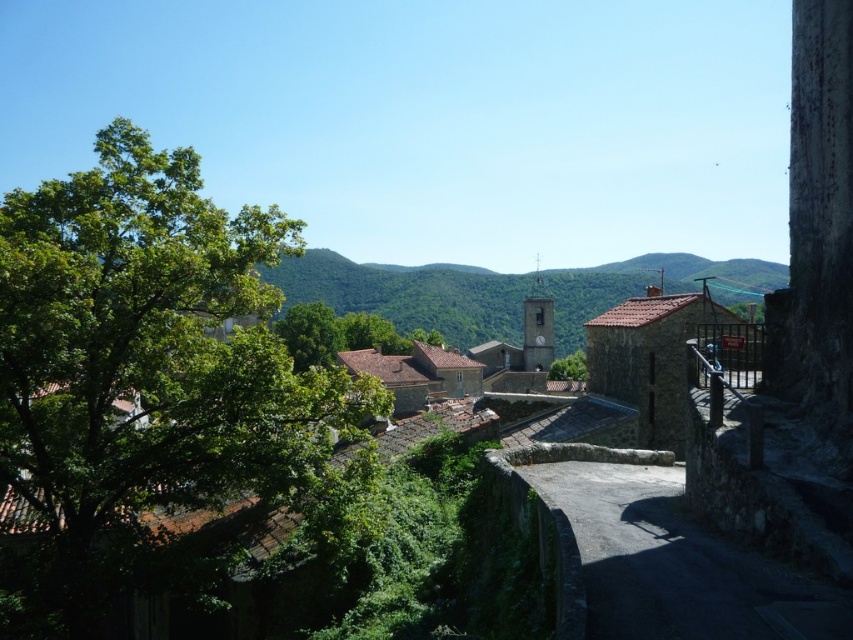
Can you confirm if green leafy tree at upper left is positioned below dark stone alley at center?

Actually, green leafy tree at upper left is above dark stone alley at center.

Is point (51, 564) positioned after point (683, 516)?

Yes.

Identify the location of green leafy tree at upper left. Image resolution: width=853 pixels, height=640 pixels. (146, 362).

Which of these two, dark stone alley at center or green leafy tree at center, stands shorter?

dark stone alley at center is shorter.

Who is more distant from viewer, (689, 627) or (575, 364)?

Point (575, 364)

Locate an element on the screen. The width and height of the screenshot is (853, 640). dark stone alley at center is located at coordinates (660, 556).

At what (x,y) coordinates should I click in order to perform the action: click on dark stone alley at center. Please return your answer as a coordinate pair (x, y). Image resolution: width=853 pixels, height=640 pixels. Looking at the image, I should click on (660, 556).

Is green leafy tree at upper left to the left of green leafy tree at center from the viewer's perspective?

Yes, green leafy tree at upper left is to the left of green leafy tree at center.

Where is `green leafy tree at upper left`? This screenshot has height=640, width=853. green leafy tree at upper left is located at coordinates (146, 362).